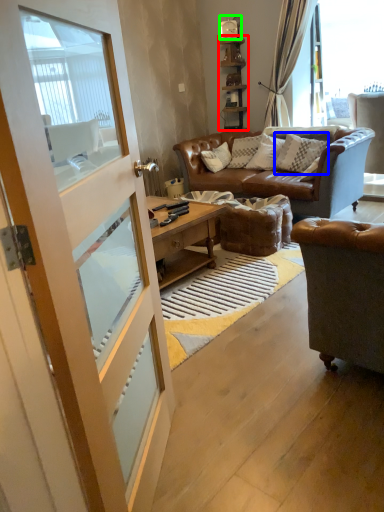
Question: Which object is the closest to the shelf (highlighted by a red box)? Choose among these: pillow (highlighted by a blue box) or clock (highlighted by a green box).

Choices:
 (A) pillow
 (B) clock

Answer: (B)